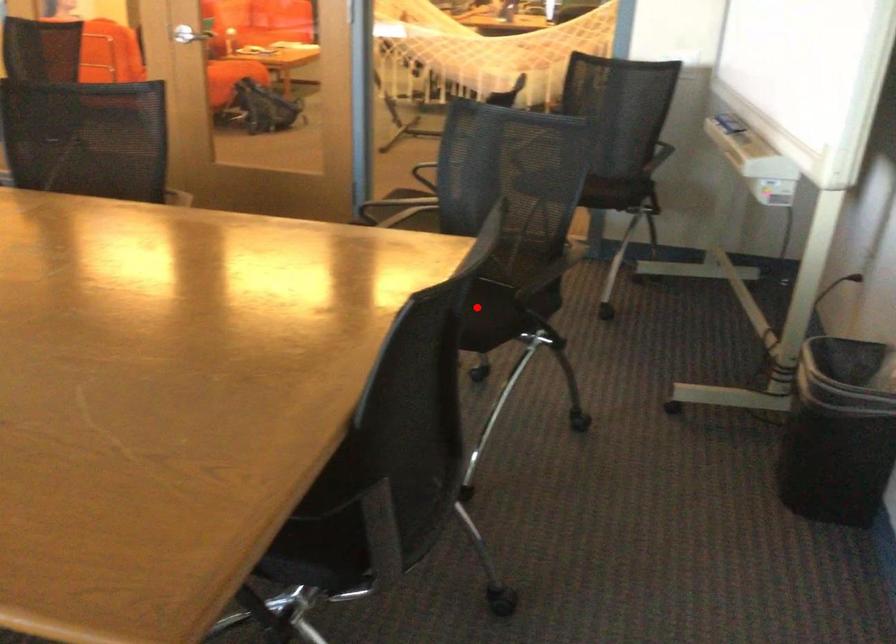
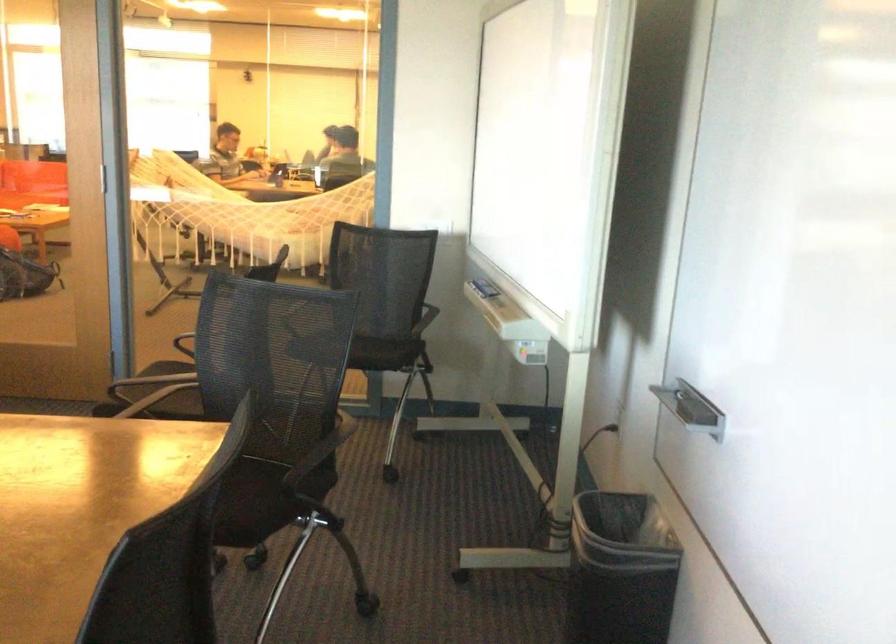
Locate, in the second image, the point that corresponds to the highlighted location in the first image.

(243, 494)